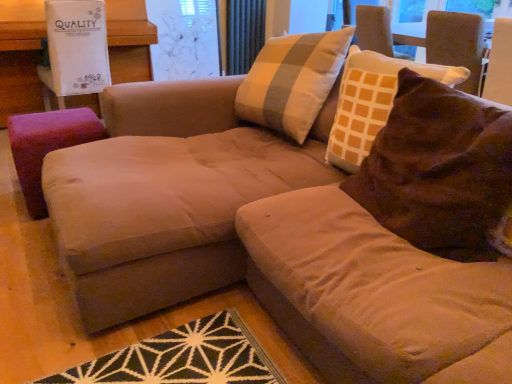
Question: Is transparent plastic screen at upper center further to camera compared to suede beige couch at center?

Choices:
 (A) no
 (B) yes

Answer: (B)

Question: Is transparent plastic screen at upper center turned away from suede beige couch at center?

Choices:
 (A) yes
 (B) no

Answer: (B)

Question: From a real-world perspective, does transparent plastic screen at upper center sit lower than suede beige couch at center?

Choices:
 (A) no
 (B) yes

Answer: (A)

Question: Does transparent plastic screen at upper center have a lesser width compared to suede beige couch at center?

Choices:
 (A) no
 (B) yes

Answer: (B)

Question: From a real-world perspective, is transparent plastic screen at upper center on suede beige couch at center?

Choices:
 (A) no
 (B) yes

Answer: (B)

Question: Is transparent plastic screen at upper center positioned before suede beige couch at center?

Choices:
 (A) yes
 (B) no

Answer: (B)

Question: Is suede beige couch at center thinner than brown velvety throw pillow at upper right?

Choices:
 (A) yes
 (B) no

Answer: (B)

Question: From the image's perspective, is suede beige couch at center located above brown velvety throw pillow at upper right?

Choices:
 (A) yes
 (B) no

Answer: (B)

Question: Is suede beige couch at center facing towards brown velvety throw pillow at upper right?

Choices:
 (A) no
 (B) yes

Answer: (B)

Question: Is suede beige couch at center at the left side of brown velvety throw pillow at upper right?

Choices:
 (A) no
 (B) yes

Answer: (A)

Question: Can you confirm if suede beige couch at center is taller than brown velvety throw pillow at upper right?

Choices:
 (A) no
 (B) yes

Answer: (B)

Question: Is the position of suede beige couch at center less distant than that of brown velvety throw pillow at upper right?

Choices:
 (A) no
 (B) yes

Answer: (B)

Question: Could you tell me if dark gray metallic radiator at upper center is turned towards transparent plastic screen at upper center?

Choices:
 (A) no
 (B) yes

Answer: (A)